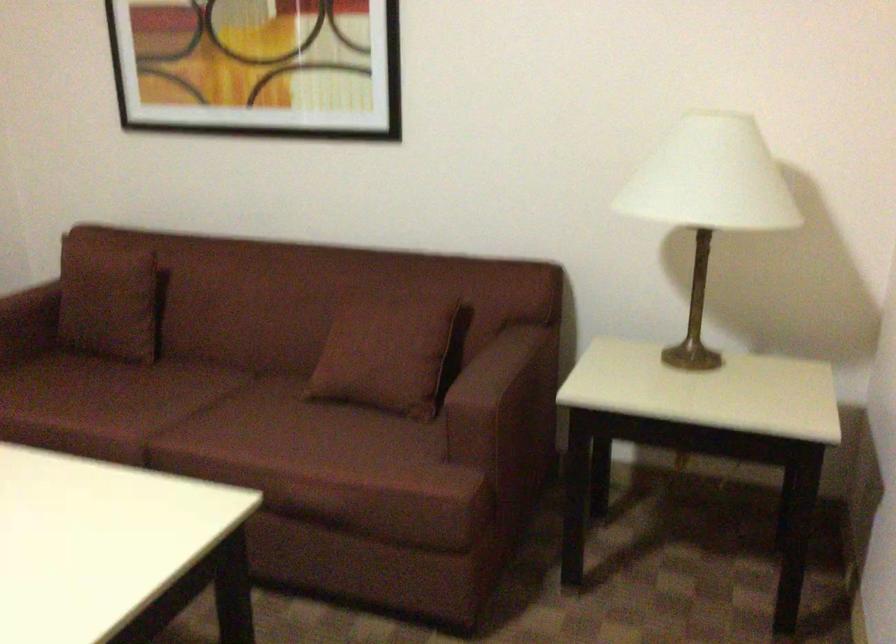
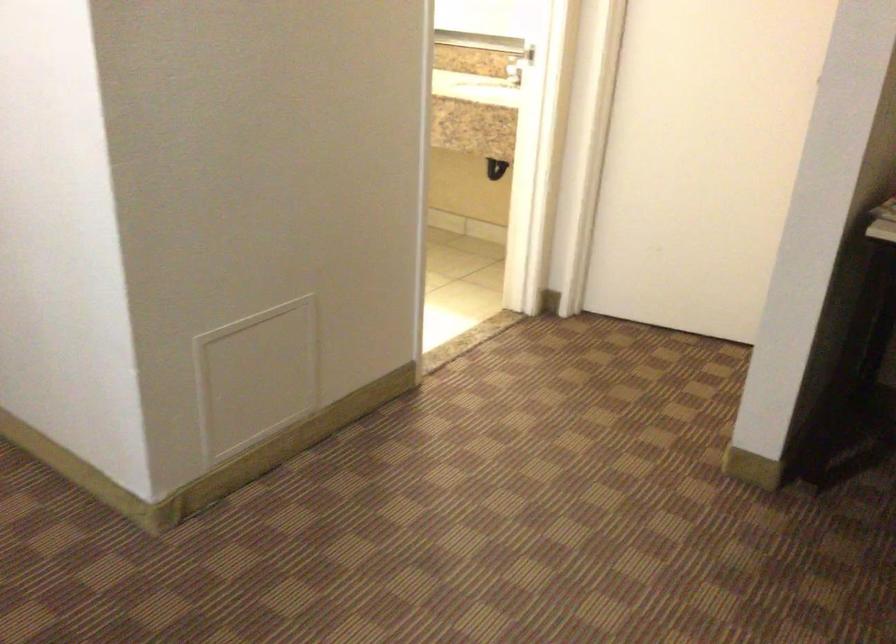
The first image is from the beginning of the video and the second image is from the end. How did the camera likely rotate when shooting the video?

The rotation direction of the camera is right-down.